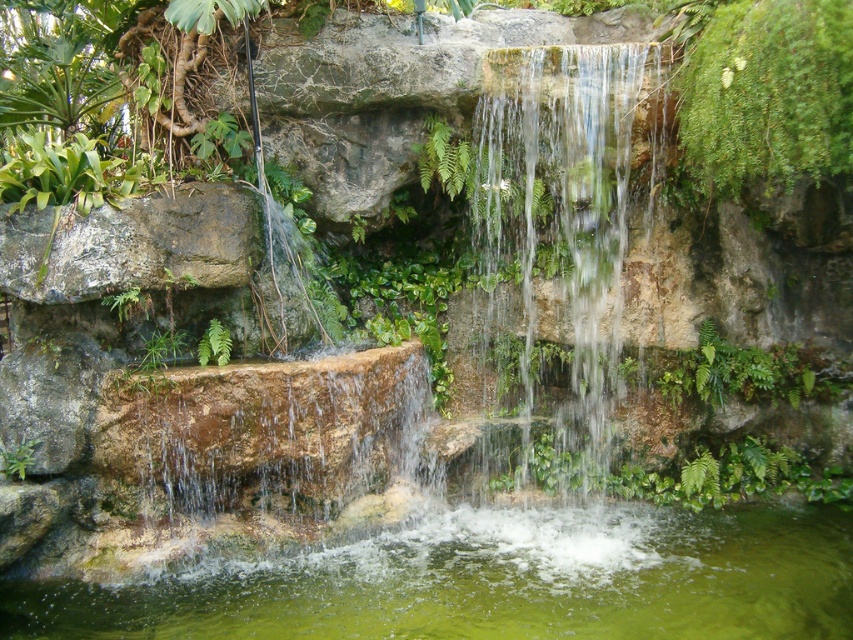
You are standing at the base of the waterfall and want to place a small decorative stone. You have two points marked in the scene, point 1 at coordinates point (x=155, y=339) and point 2 at coordinates point (x=21, y=468). Which point is closer to you where you can place the stone without it being too far away?

Point (x=155, y=339) is closer to you than point (x=21, y=468), so you can place the stone there without it being too far away.